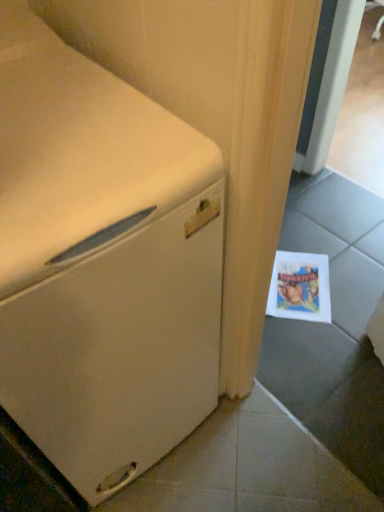
Where is `white matte refrigerator at left`? The width and height of the screenshot is (384, 512). white matte refrigerator at left is located at coordinates (102, 262).

What do you see at coordinates (102, 262) in the screenshot? The width and height of the screenshot is (384, 512). I see `white matte refrigerator at left` at bounding box center [102, 262].

What do you see at coordinates (300, 287) in the screenshot? I see `matte paper postcard at lower right` at bounding box center [300, 287].

In the scene shown: Measure the distance between matte paper postcard at lower right and camera.

The depth of matte paper postcard at lower right is 4.60 feet.

Find the location of `matte paper postcard at lower right`. matte paper postcard at lower right is located at coordinates (300, 287).

Locate an element on the screen. white matte refrigerator at left is located at coordinates (102, 262).

Which object is positioned more to the left, white matte refrigerator at left or matte paper postcard at lower right?

From the viewer's perspective, white matte refrigerator at left appears more on the left side.

Which object is closer to the camera taking this photo, white matte refrigerator at left or matte paper postcard at lower right?

Positioned in front is white matte refrigerator at left.

Considering the positions of point (173, 333) and point (287, 252), is point (173, 333) closer or farther from the camera than point (287, 252)?

Point (173, 333).

From the image's perspective, which one is positioned lower, white matte refrigerator at left or matte paper postcard at lower right?

matte paper postcard at lower right is shown below in the image.

From a real-world perspective, between white matte refrigerator at left and matte paper postcard at lower right, who is vertically higher?

From a 3D spatial view, white matte refrigerator at left is above.

Which of these two, white matte refrigerator at left or matte paper postcard at lower right, is wider?

With larger width is white matte refrigerator at left.

Is white matte refrigerator at left taller than matte paper postcard at lower right?

Yes.

Between white matte refrigerator at left and matte paper postcard at lower right, which one has smaller size?

Smaller between the two is matte paper postcard at lower right.

Do you think white matte refrigerator at left is within matte paper postcard at lower right, or outside of it?

white matte refrigerator at left is located beyond the bounds of matte paper postcard at lower right.

Is white matte refrigerator at left with matte paper postcard at lower right?

No, white matte refrigerator at left is not touching matte paper postcard at lower right.

Is white matte refrigerator at left oriented towards matte paper postcard at lower right?

No, white matte refrigerator at left is not turned towards matte paper postcard at lower right.

How many degrees apart are the facing directions of white matte refrigerator at left and matte paper postcard at lower right?

There is a 48-degree angle between the facing directions of white matte refrigerator at left and matte paper postcard at lower right.

Locate an element on the screen. The height and width of the screenshot is (512, 384). postcard behind the white matte refrigerator at left is located at coordinates (300, 287).

Which object is positioned more to the left, matte paper postcard at lower right or white matte refrigerator at left?

white matte refrigerator at left.

Looking at this image, between matte paper postcard at lower right and white matte refrigerator at left, which one is positioned in front?

white matte refrigerator at left.

Which is closer to the camera, (273,270) or (120,477)?

Point (273,270) appears to be farther away from the viewer than point (120,477).

From the image's perspective, is matte paper postcard at lower right under white matte refrigerator at left?

Indeed, from the image's perspective, matte paper postcard at lower right is shown beneath white matte refrigerator at left.

From a real-world perspective, between matte paper postcard at lower right and white matte refrigerator at left, who is vertically higher?

From a 3D spatial view, white matte refrigerator at left is above.

In the scene shown: Considering the relative sizes of matte paper postcard at lower right and white matte refrigerator at left in the image provided, is matte paper postcard at lower right thinner than white matte refrigerator at left?

Yes, matte paper postcard at lower right is thinner than white matte refrigerator at left.

Can you confirm if matte paper postcard at lower right is taller than white matte refrigerator at left?

No.

Considering the sizes of objects matte paper postcard at lower right and white matte refrigerator at left in the image provided, who is smaller, matte paper postcard at lower right or white matte refrigerator at left?

matte paper postcard at lower right is smaller.

Based on the photo, would you say matte paper postcard at lower right is inside or outside white matte refrigerator at left?

The correct answer is: outside.

Are matte paper postcard at lower right and white matte refrigerator at left beside each other?

No, matte paper postcard at lower right is not making contact with white matte refrigerator at left.

Is matte paper postcard at lower right facing away from white matte refrigerator at left?

No.

How different are the orientations of matte paper postcard at lower right and white matte refrigerator at left in degrees?

The facing directions of matte paper postcard at lower right and white matte refrigerator at left are 48 degrees apart.

In the image, there is a white matte refrigerator at left. Where is `postcard below it (from the image's perspective)`? postcard below it (from the image's perspective) is located at coordinates (300, 287).

At what (x,y) coordinates should I click in order to perform the action: click on home appliance located on the left of matte paper postcard at lower right. Please return your answer as a coordinate pair (x, y). This screenshot has width=384, height=512. Looking at the image, I should click on (102, 262).

Where is `postcard that is behind the white matte refrigerator at left`? This screenshot has height=512, width=384. postcard that is behind the white matte refrigerator at left is located at coordinates (300, 287).